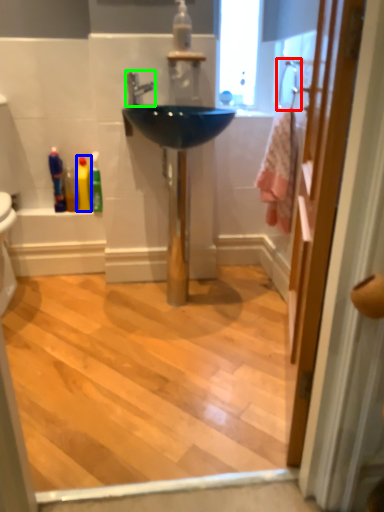
Question: Considering the real-world distances, which object is closest to shower (highlighted by a red box)? toiletry (highlighted by a blue box) or tap (highlighted by a green box).

Choices:
 (A) toiletry
 (B) tap

Answer: (B)